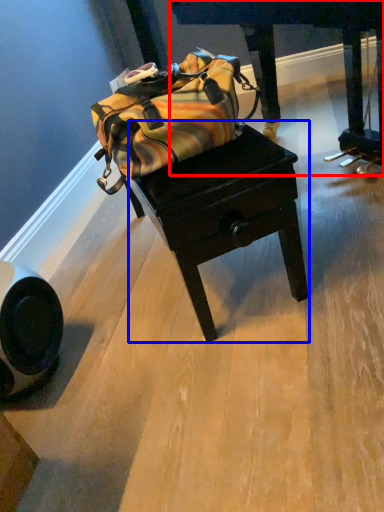
Question: Which object is closer to the camera taking this photo, furniture (highlighted by a red box) or table (highlighted by a blue box)?

Choices:
 (A) furniture
 (B) table

Answer: (A)